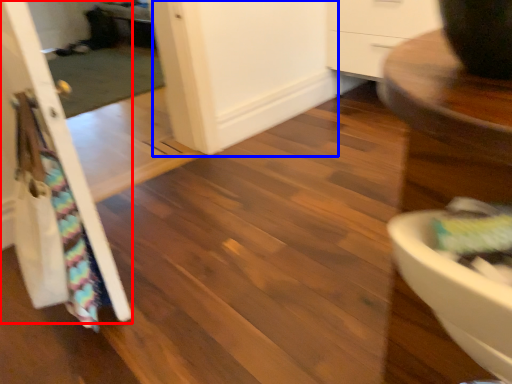
Question: Which point is further to the camera, door (highlighted by a red box) or screen door (highlighted by a blue box)?

Choices:
 (A) door
 (B) screen door

Answer: (B)